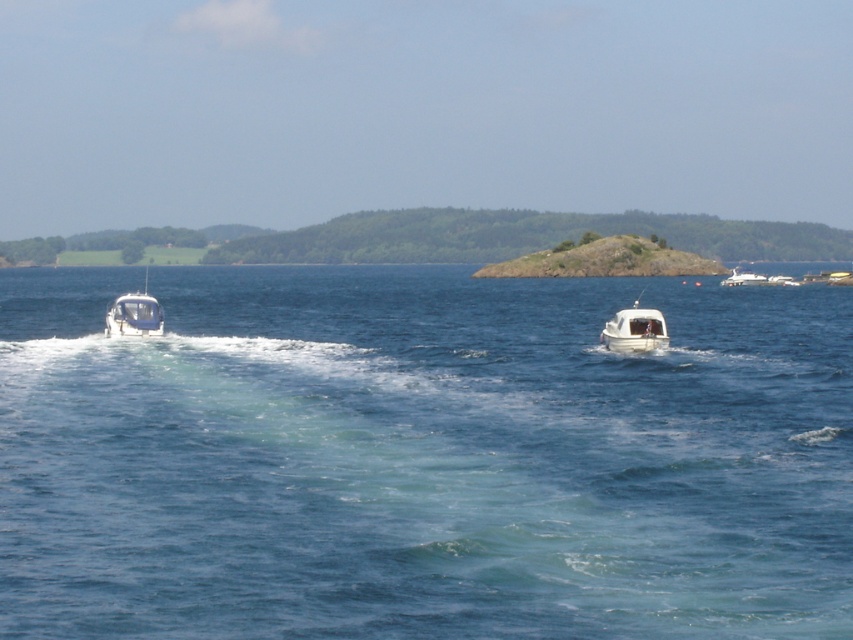
You are a drone operator trying to capture the best aerial shot of the blue water at center. You are currently positioned at point (421, 458). What should you do to ensure you are capturing the blue water at center in your shot?

Since the blue water at center is located exactly at point (421, 458), you are already positioned directly over it. To capture the blue water at center, maintain your current position and adjust your camera angle to face downward for an optimal shot.

You are a sailor on a yacht and need to navigate between the blue water at center and the white matte boat at center. Given that your yacht requires a minimum of 200 feet of clearance to safely pass between two points, can you safely navigate through this area?

The distance between the blue water at center and the white matte boat at center is 171.55 feet, which is less than the required 200 feet clearance. Therefore, navigating through this area would not be safe for your yacht.

You are a photographer trying to capture the blue water at center and the white matte boat at center in a single shot. Based on their positions, which one would appear closer to the camera in the photo?

The blue water at center appears closer to the camera because it has a greater height compared to the white matte boat at center.